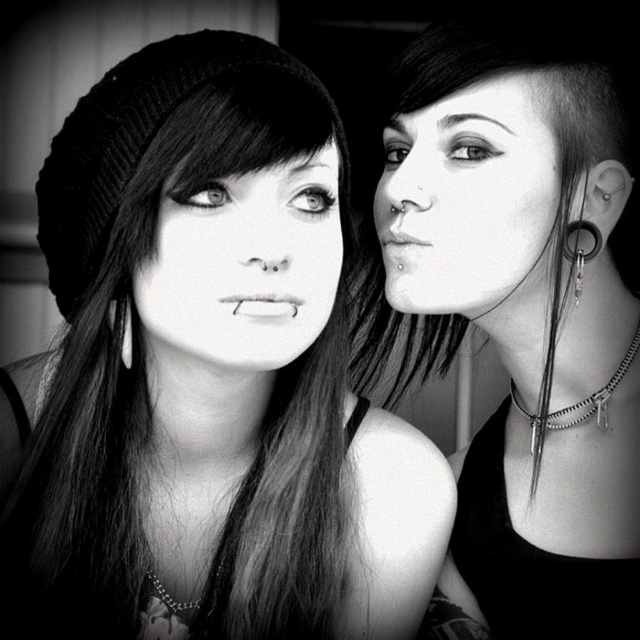
Question: Based on their relative distances, which object is farther from the knitted black beanie at left?

Choices:
 (A) knitted beanie at upper left
 (B) silver metallic earring at left
 (C) smooth skin face at right

Answer: (C)

Question: Which of these objects is positioned farthest from the silver metallic spike at right?

Choices:
 (A) shiny silver earring at upper right
 (B) knitted black beanie at left

Answer: (B)

Question: Can you confirm if knitted black beanie at left is positioned below silver metallic earring at left?

Choices:
 (A) no
 (B) yes

Answer: (A)

Question: Does knitted beanie at upper left have a larger size compared to smooth skin face at center?

Choices:
 (A) no
 (B) yes

Answer: (B)

Question: Can you confirm if smooth skin face at right is thinner than silver metallic spike at right?

Choices:
 (A) yes
 (B) no

Answer: (B)

Question: Which object is the farthest from the shiny silver earring at upper right?

Choices:
 (A) smooth skin face at center
 (B) smooth skin face at right

Answer: (A)